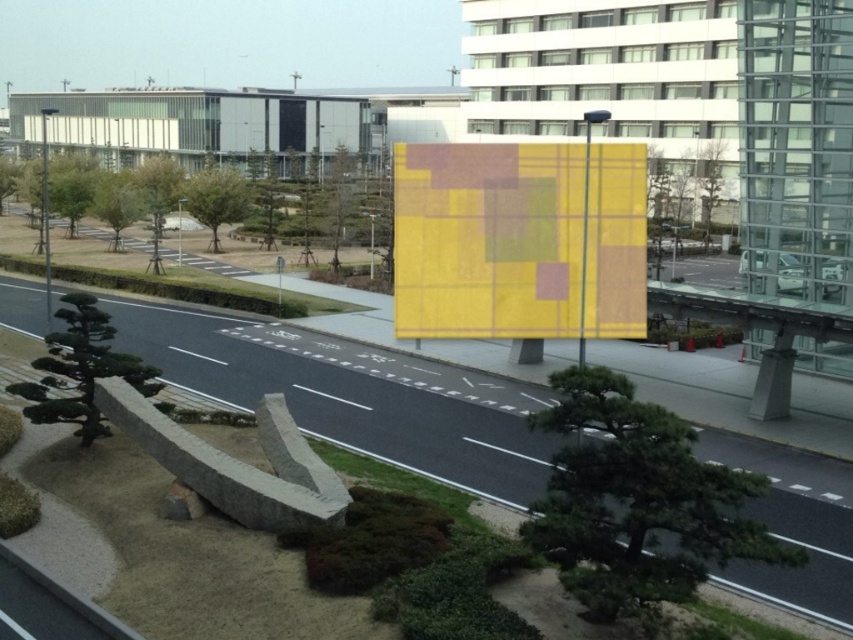
Measure the distance between smooth asphalt highway at center and yellow plaid fabric at center.

16.75 feet

Between smooth asphalt highway at center and yellow plaid fabric at center, which one appears on the left side from the viewer's perspective?

Positioned to the left is smooth asphalt highway at center.

I want to click on smooth asphalt highway at center, so click(352, 394).

The height and width of the screenshot is (640, 853). Identify the location of smooth asphalt highway at center. (352, 394).